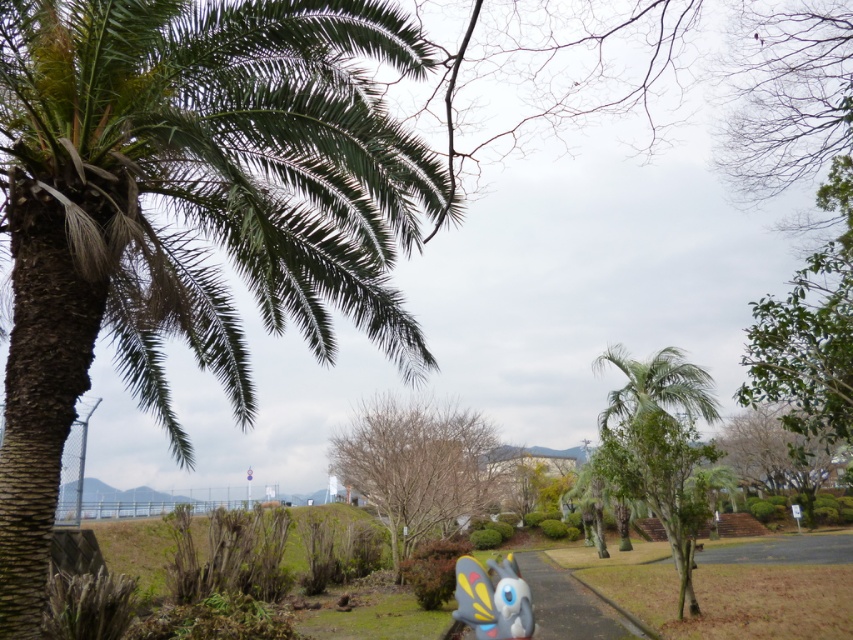
Which is below, green leafy palm at left or matte plastic butterfly at lower center?

matte plastic butterfly at lower center is lower down.

Is point (368, 54) positioned after point (519, 621)?

Yes, point (368, 54) is behind point (519, 621).

Between point (259, 236) and point (529, 630), which one is positioned in front?

Positioned in front is point (259, 236).

Image resolution: width=853 pixels, height=640 pixels. What are the coordinates of `green leafy palm at left` in the screenshot? It's located at (189, 211).

Who is more distant from viewer, (453, 515) or (656, 515)?

The point (453, 515) is behind.

Who is positioned more to the right, bare wood tree at center or green leafy palm tree at center?

green leafy palm tree at center is more to the right.

The height and width of the screenshot is (640, 853). What do you see at coordinates (416, 467) in the screenshot?
I see `bare wood tree at center` at bounding box center [416, 467].

This screenshot has height=640, width=853. In order to click on bare wood tree at center in this screenshot , I will do `click(416, 467)`.

Is point (207, 353) farther from camera compared to point (573, 636)?

Yes, it is behind point (573, 636).

Is green leafy palm at left positioned before gray asphalt pavement at lower center?

Yes, green leafy palm at left is closer to the viewer.

Between point (270, 188) and point (614, 627), which one is positioned behind?

Positioned behind is point (614, 627).

The width and height of the screenshot is (853, 640). In order to click on green leafy palm at left in this screenshot , I will do `click(189, 211)`.